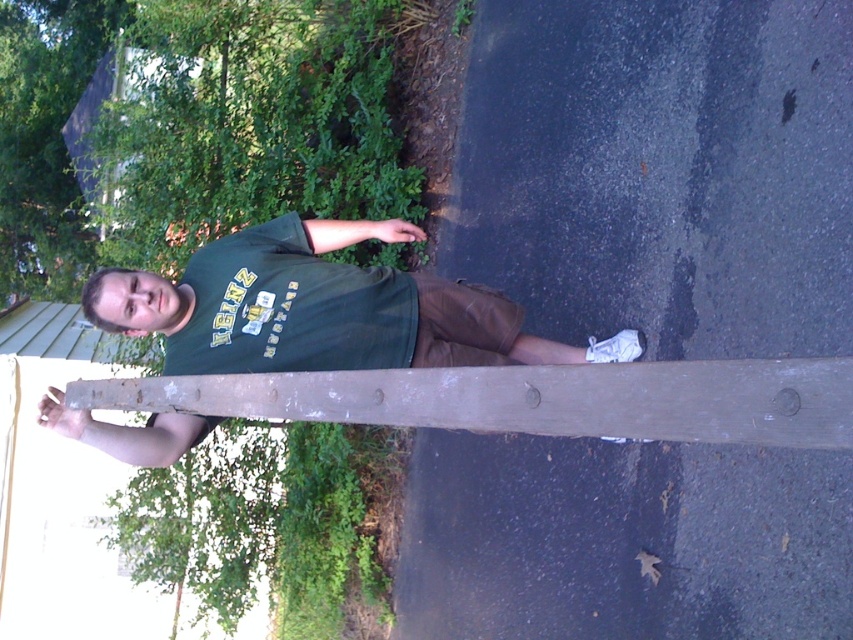
Which is above, green matte shirt at center or weathered wood plank at center?

green matte shirt at center

Who is lower down, green matte shirt at center or weathered wood plank at center?

weathered wood plank at center is below.

This screenshot has width=853, height=640. What do you see at coordinates (322, 308) in the screenshot?
I see `green matte shirt at center` at bounding box center [322, 308].

This screenshot has width=853, height=640. In order to click on green matte shirt at center in this screenshot , I will do `click(322, 308)`.